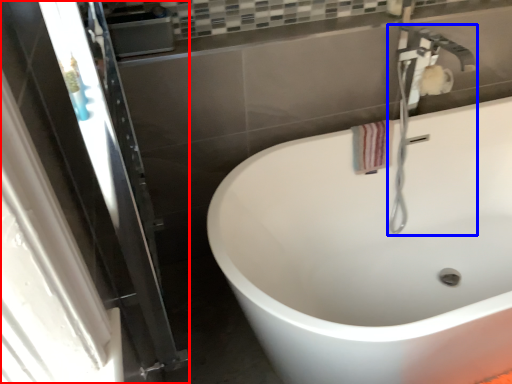
Question: Which object is further to the camera taking this photo, screen door (highlighted by a red box) or plumbing fixture (highlighted by a blue box)?

Choices:
 (A) screen door
 (B) plumbing fixture

Answer: (B)